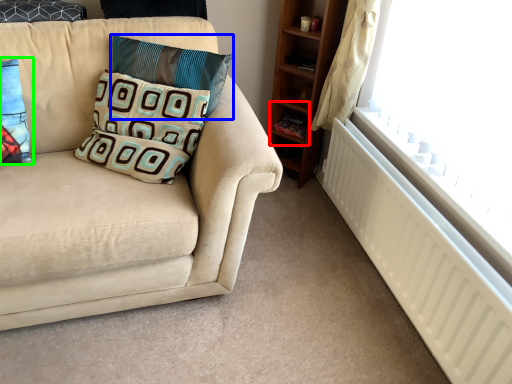
Question: Considering the real-world distances, which object is farthest from shelf (highlighted by a red box)? pillow (highlighted by a blue box) or pillow (highlighted by a green box)?

Choices:
 (A) pillow
 (B) pillow

Answer: (B)